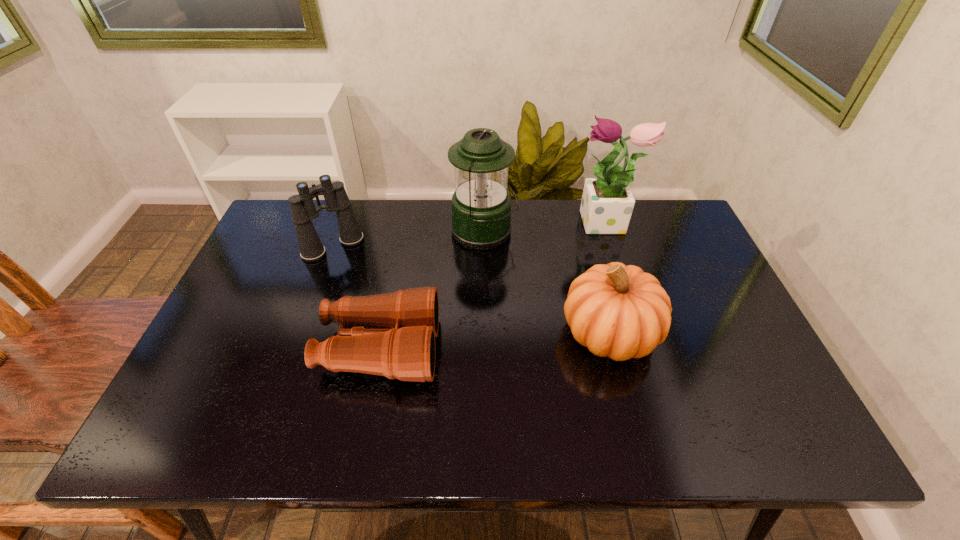
Locate an element on the screen. The width and height of the screenshot is (960, 540). free location at the left edge of the desktop is located at coordinates (202, 399).

At what (x,y) coordinates should I click in order to perform the action: click on free spot at the right edge of the desktop. Please return your answer as a coordinate pair (x, y). This screenshot has height=540, width=960. Looking at the image, I should click on (734, 383).

The width and height of the screenshot is (960, 540). In the image, there is a desktop. Find the location of `vacant space at the far left corner`. vacant space at the far left corner is located at coordinates (294, 234).

This screenshot has height=540, width=960. In order to click on vacant region at the near right corner of the desktop in this screenshot , I will do `click(751, 443)`.

Locate an element on the screen. The width and height of the screenshot is (960, 540). free space between the lantern and the flower arrangement is located at coordinates (544, 229).

Locate an element on the screen. This screenshot has height=540, width=960. vacant space that is in between the shortest object and the pumpkin is located at coordinates (494, 341).

At what (x,y) coordinates should I click in order to perform the action: click on unoccupied area between the flower arrangement and the third object from left to right. Please return your answer as a coordinate pair (x, y). Looking at the image, I should click on (544, 229).

The height and width of the screenshot is (540, 960). In order to click on vacant space in between the pumpkin and the nearer binoculars in this screenshot , I will do `click(494, 341)`.

You are a GUI agent. You are given a task and a screenshot of the screen. Output one action in this format:
    pyautogui.click(x=<x>, y=<y>)
    Task: Click on the free space between the pumpkin and the farther binoculars
    Image resolution: width=960 pixels, height=540 pixels.
    Given the screenshot: What is the action you would take?
    [471, 289]

Locate an element on the screen. This screenshot has width=960, height=540. free area in between the pumpkin and the taller binoculars is located at coordinates (471, 289).